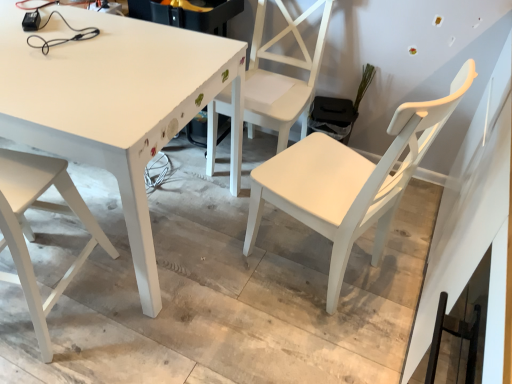
You are a GUI agent. You are given a task and a screenshot of the screen. Output one action in this format:
    pyautogui.click(x=<x>, y=<y>)
    Task: Click on the free space between white matte chair at center, which appears as the 1th chair when viewed from the right, and white painted wood table at center
    
    Given the screenshot: What is the action you would take?
    point(243,289)